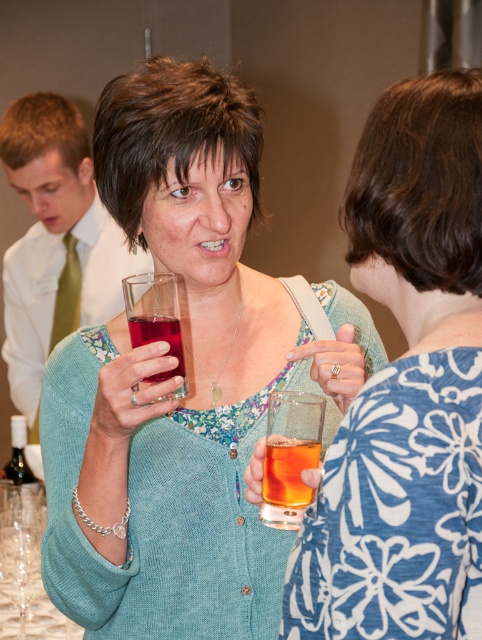
Question: Is green silk tie at left wider than translucent amber liquid at center?

Choices:
 (A) yes
 (B) no

Answer: (A)

Question: Which object is the farthest from the transparent plastic glass at center?

Choices:
 (A) translucent glass at center
 (B) matte glass at center

Answer: (A)

Question: Does matte glass at center have a larger size compared to translucent glass at center?

Choices:
 (A) no
 (B) yes

Answer: (B)

Question: Which point is farther to the camera?

Choices:
 (A) (288, 499)
 (B) (12, 113)
 (C) (19, 465)
 (D) (254, 509)

Answer: (B)

Question: Which point appears farthest from the camera in this image?

Choices:
 (A) (99, 243)
 (B) (155, 291)

Answer: (A)

Question: From the image, what is the correct spatial relationship of matte glass at center in relation to green silk tie at left?

Choices:
 (A) right
 (B) left

Answer: (A)